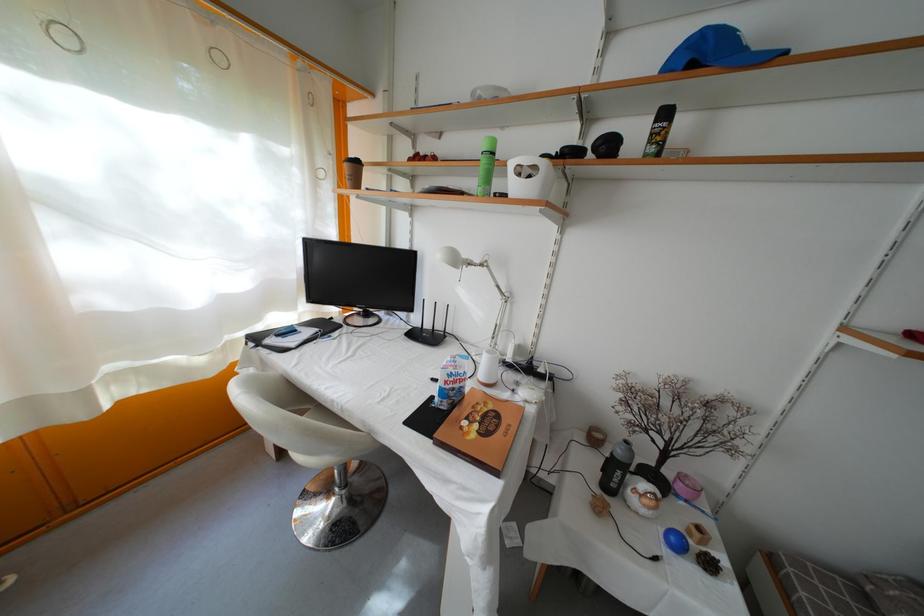
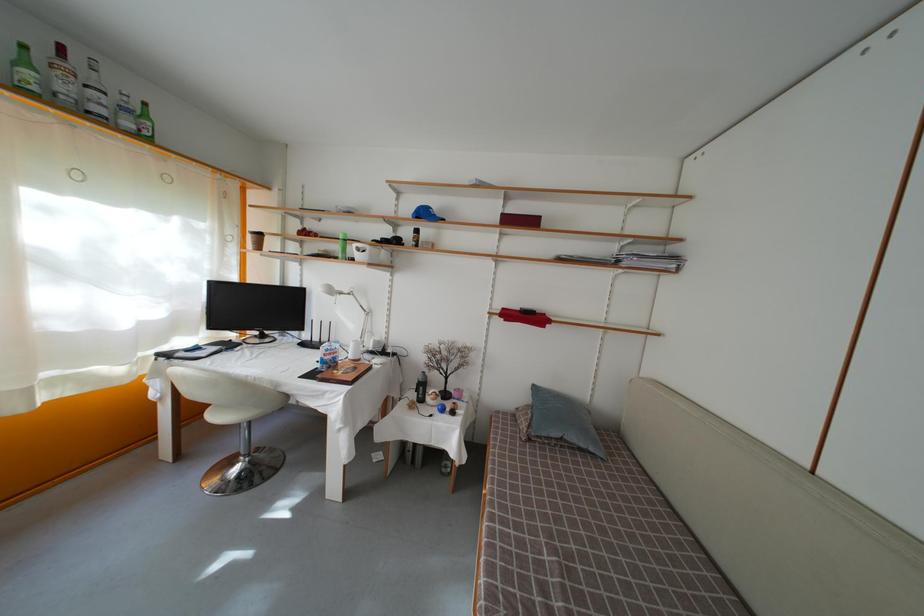
Find the pixel in the second image that matches (x=487, y=272) in the first image.

(355, 301)